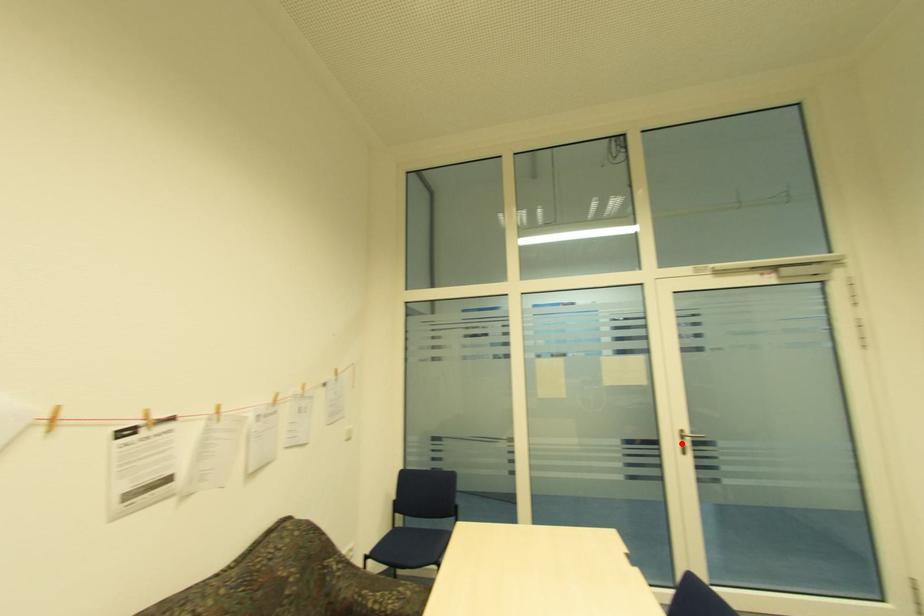
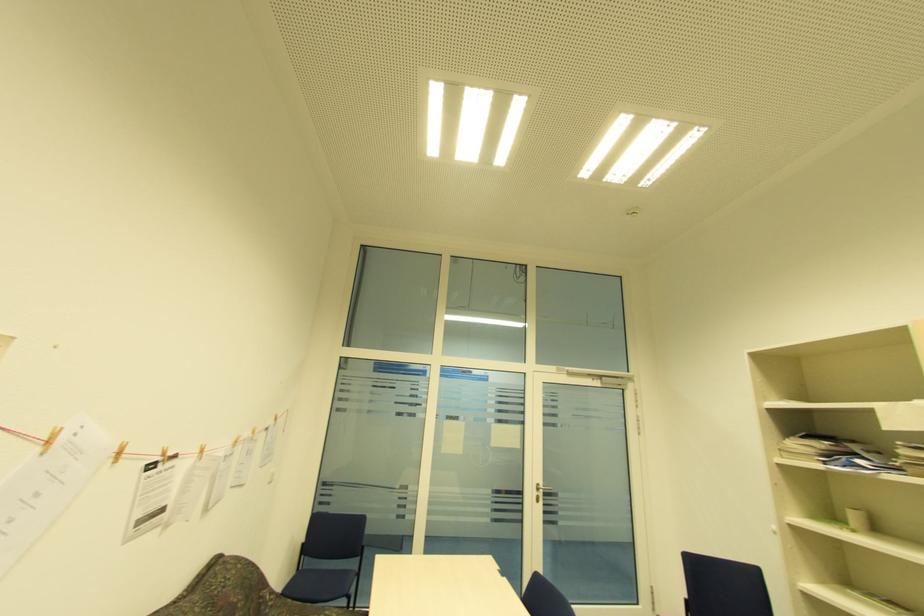
Where in the second image is the point corresponding to the highlighted location from the first image?

(538, 493)